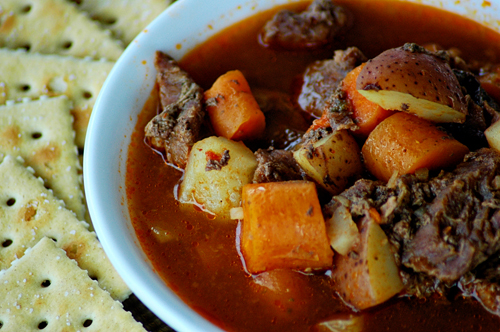
The image size is (500, 332). I want to click on bowl, so (184, 20).